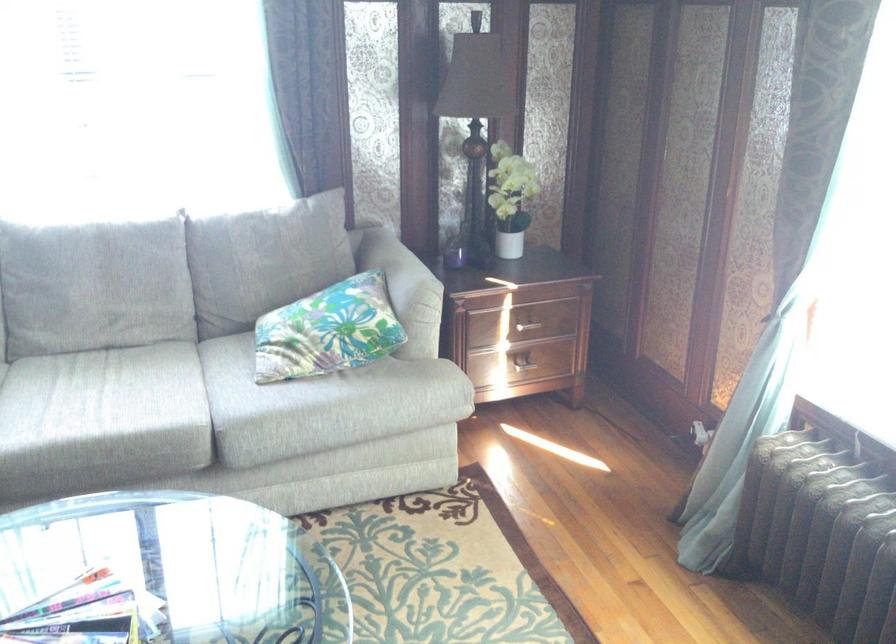
Where is `sofa sitting surface`? The width and height of the screenshot is (896, 644). sofa sitting surface is located at coordinates (108, 402).